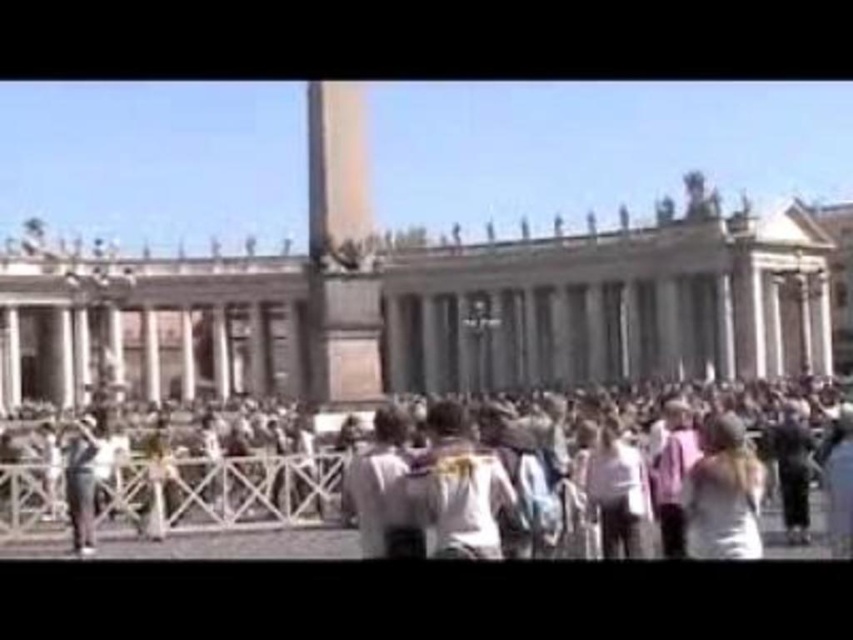
Question: Estimate the real-world distances between objects in this image. Which object is farther from the pink fabric shirt at center?

Choices:
 (A) white fabric dress at center
 (B) white casual clothing at center
 (C) white matte shirt at center

Answer: (B)

Question: Which object appears farthest from the camera in this image?

Choices:
 (A) white fabric shirt at center
 (B) white fabric dress at center
 (C) denim jacket at lower left
 (D) white cotton shirt at center

Answer: (C)

Question: Is white casual clothing at center above white cotton shirt at center?

Choices:
 (A) no
 (B) yes

Answer: (A)

Question: Does pink fabric shirt at center appear on the right side of denim jacket at lower left?

Choices:
 (A) no
 (B) yes

Answer: (B)

Question: Does white fabric dress at center appear on the right side of white matte shirt at center?

Choices:
 (A) no
 (B) yes

Answer: (B)

Question: Among these objects, which one is nearest to the camera?

Choices:
 (A) pink fabric shirt at center
 (B) white matte shirt at center

Answer: (A)